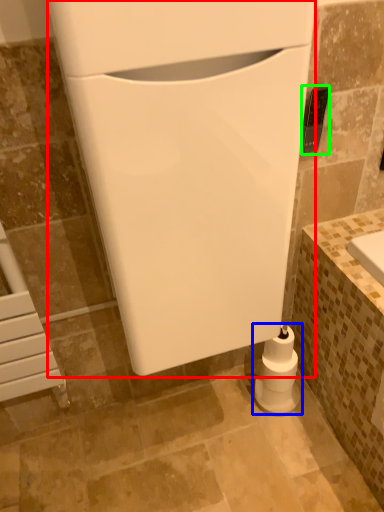
Question: Estimate the real-world distances between objects in this image. Which object is closer to appliance (highlighted by a red box), toilet paper (highlighted by a blue box) or appliance (highlighted by a green box)?

Choices:
 (A) toilet paper
 (B) appliance

Answer: (B)